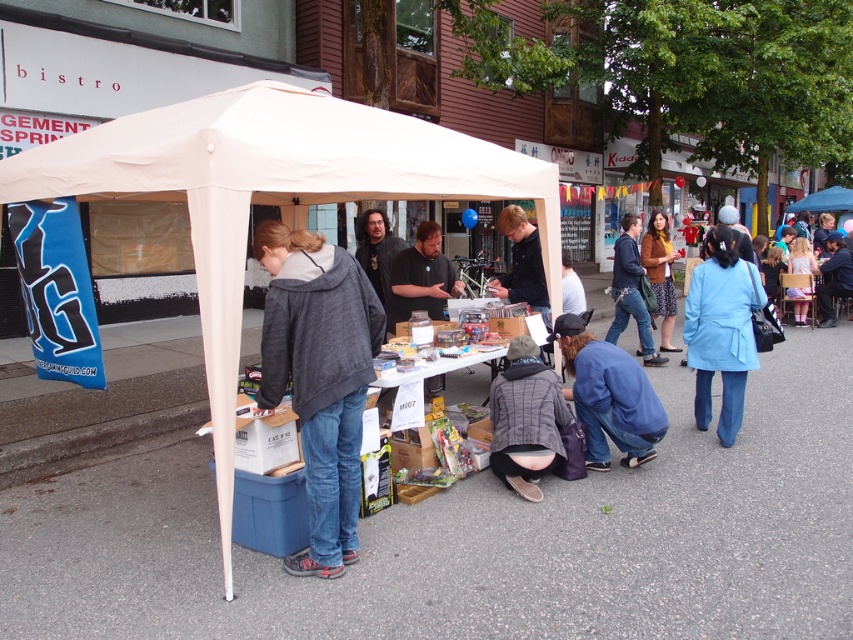
You are a delivery person who needs to place a large package that is 6 feet long in the space between the white fabric tent at center and the matte black shirt at center. Is there enough space to fit the package without moving either object?

The distance between the white fabric tent at center and the matte black shirt at center is 5.74 feet. Since the package is 6 feet long, it is slightly longer than the available space. Therefore, the package cannot be placed there without moving either object.

You are a customer at the market and want to find the taller person between the dark gray hoodie at center and the blue fabric coat at lower right. Which one should you look for?

The blue fabric coat at lower right is taller than the dark gray hoodie at center, so you should look for the blue fabric coat at lower right.

You are a visitor at the market and want to approach both the dark gray hoodie at center and the blue fabric coat at lower right. Which one should you head towards first if you want to reach the one closer to you first?

The dark gray hoodie at center is closer to the viewer than the blue fabric coat at lower right, so you should head towards the dark gray hoodie at center first.